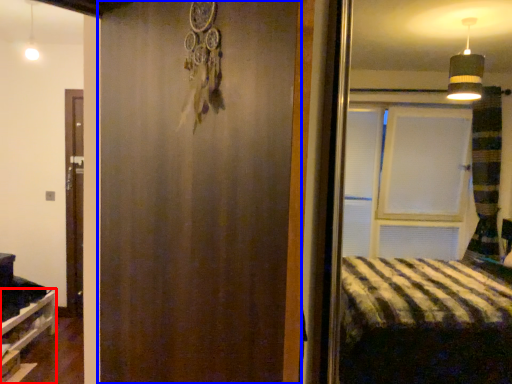
Question: Among these objects, which one is farthest to the camera, shelf (highlighted by a red box) or barn door (highlighted by a blue box)?

Choices:
 (A) shelf
 (B) barn door

Answer: (A)